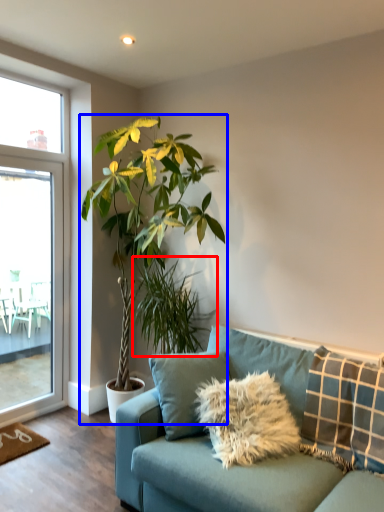
Question: Which object appears farthest to the camera in this image, houseplant (highlighted by a red box) or houseplant (highlighted by a blue box)?

Choices:
 (A) houseplant
 (B) houseplant

Answer: (A)